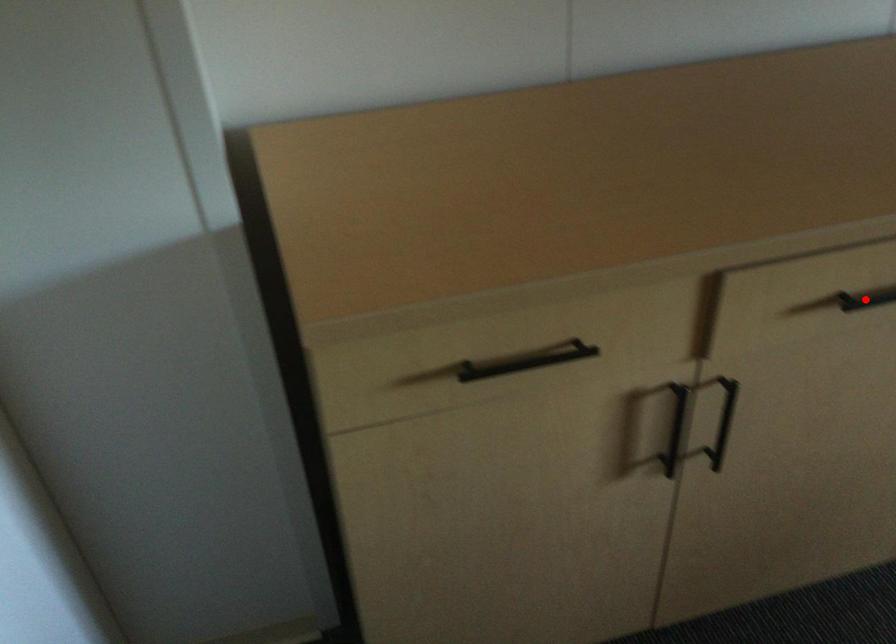
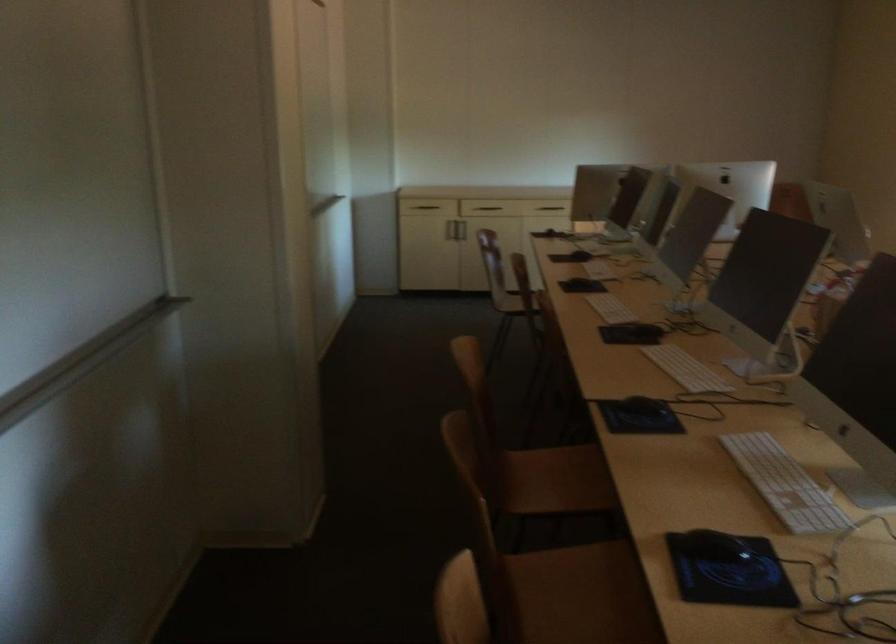
Question: I am providing you with two images of the same scene from different viewpoints. A red point is marked on the first image. Can you still see the location of the red point in image 2?

Choices:
 (A) Yes
 (B) No

Answer: (B)